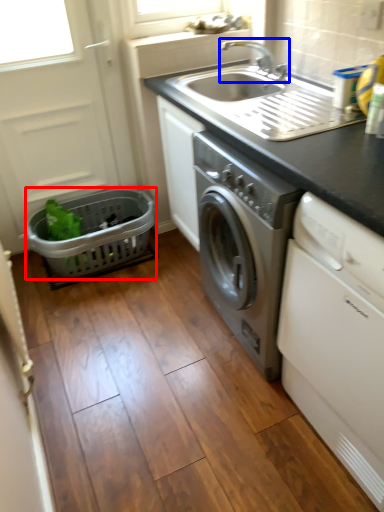
Question: Which point is closer to the camera, basket (highlighted by a red box) or tap (highlighted by a blue box)?

Choices:
 (A) basket
 (B) tap

Answer: (B)